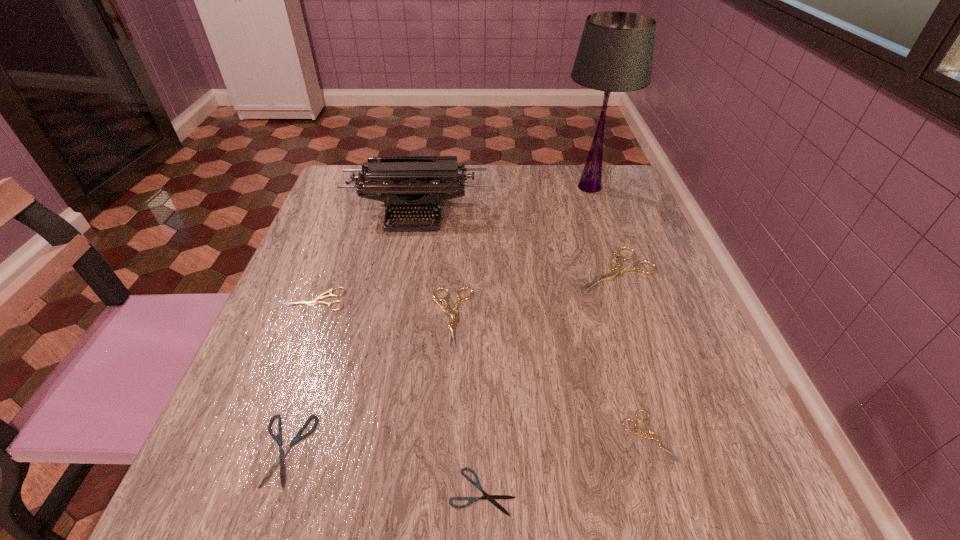
Where is `the right black shears`? the right black shears is located at coordinates [x=490, y=498].

The image size is (960, 540). I want to click on the shortest shears, so pos(490,498).

Locate an element on the screen. This screenshot has width=960, height=540. free space located 0.390m on the front-facing side of the lampshade is located at coordinates (636, 323).

The width and height of the screenshot is (960, 540). I want to click on free space located 0.400m on the typing side of the seventh shortest object, so click(385, 381).

The height and width of the screenshot is (540, 960). In order to click on vacant space situated 0.280m on the front of the biggest beige shears in this screenshot , I will do `click(666, 421)`.

You are a GUI agent. You are given a task and a screenshot of the screen. Output one action in this format:
    pyautogui.click(x=<x>, y=<y>)
    Task: Click on the free point located on the left of the fifth shortest object
    The height and width of the screenshot is (540, 960).
    Given the screenshot: What is the action you would take?
    pyautogui.click(x=335, y=316)

Find the location of a particular element. This screenshot has height=540, width=960. free space located on the right of the fourth shortest shears is located at coordinates (457, 300).

Find the location of `free space located on the back of the nearest beige shears`. free space located on the back of the nearest beige shears is located at coordinates (601, 276).

At what (x,y) coordinates should I click in order to perform the action: click on free space located 0.360m on the back of the left black shears. Please return your answer as a coordinate pair (x, y). Looking at the image, I should click on (348, 263).

Locate an element on the screen. vacant region located on the left of the shortest shears is located at coordinates [405, 492].